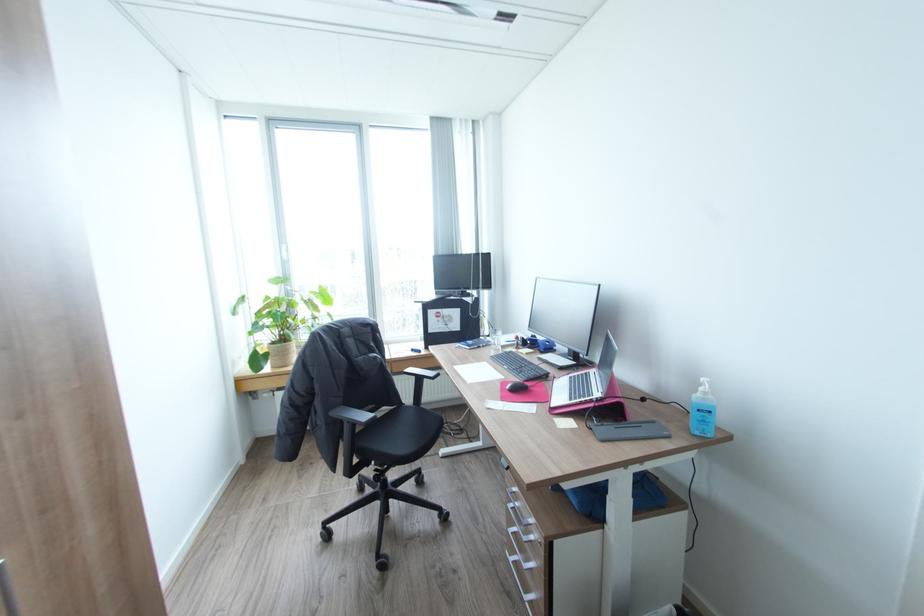
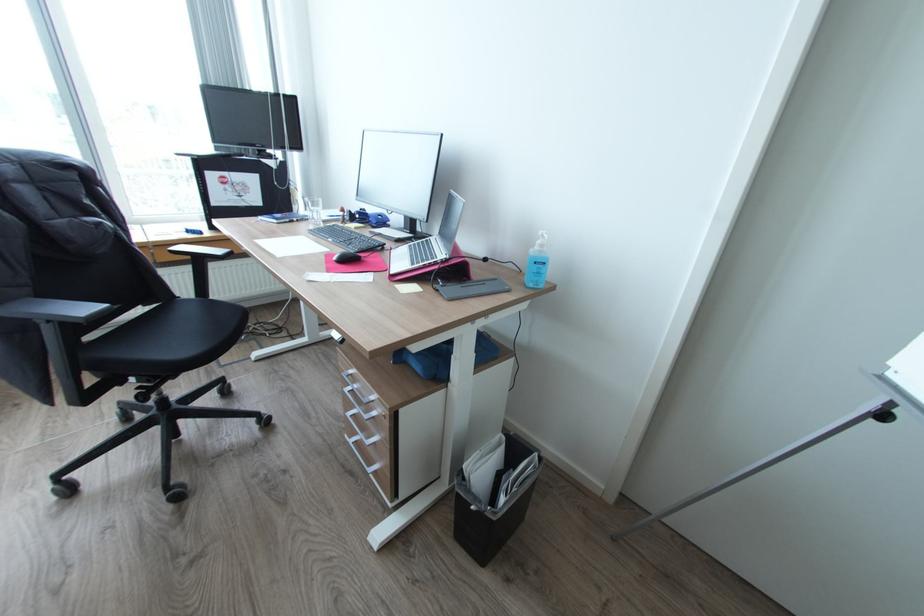
In the second image, find the point that corresponds to the point at 710,392 in the first image.

(545, 245)